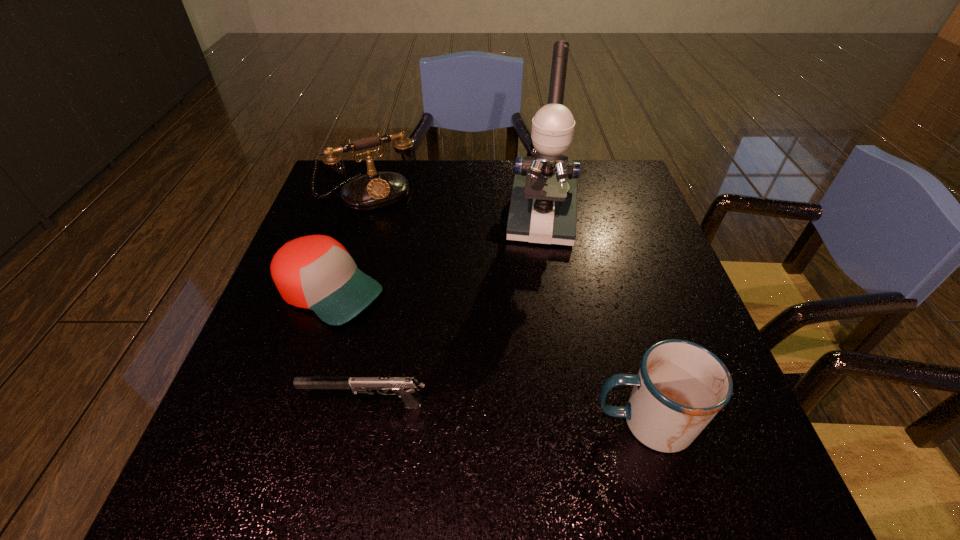
The width and height of the screenshot is (960, 540). I want to click on vacant space located 0.320m on the handle side of the mug, so click(413, 422).

Where is `free region located 0.050m on the handle side of the mug`? The height and width of the screenshot is (540, 960). free region located 0.050m on the handle side of the mug is located at coordinates (565, 422).

At what (x,y) coordinates should I click in order to perform the action: click on free location located at the brim of the fourth tallest object. Please return your answer as a coordinate pair (x, y). Looking at the image, I should click on (432, 348).

Image resolution: width=960 pixels, height=540 pixels. Find the location of `blank area located 0.400m at the brim of the fourth tallest object`. blank area located 0.400m at the brim of the fourth tallest object is located at coordinates (531, 406).

The width and height of the screenshot is (960, 540). Identify the location of vacant area situated at the brim of the fourth tallest object. (521, 401).

Identify the location of vacant space located 0.150m on the dial of the telephone. (406, 242).

Identify the location of vacant point located on the dial of the telephone. This screenshot has height=540, width=960. (418, 261).

Where is `vacant space located 0.190m on the dial of the telephone`? Image resolution: width=960 pixels, height=540 pixels. vacant space located 0.190m on the dial of the telephone is located at coordinates (412, 251).

Identify the location of vacant space located at the eyepiece of the tallest object. Image resolution: width=960 pixels, height=540 pixels. (530, 382).

The height and width of the screenshot is (540, 960). Find the location of `vacant area situated at the eyepiece of the tallest object`. vacant area situated at the eyepiece of the tallest object is located at coordinates 535,315.